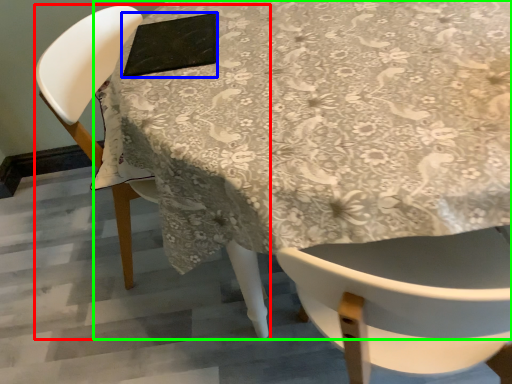
Question: Which is nearer to the chair (highlighted by a red box)? pad (highlighted by a blue box) or table (highlighted by a green box).

Choices:
 (A) pad
 (B) table

Answer: (A)